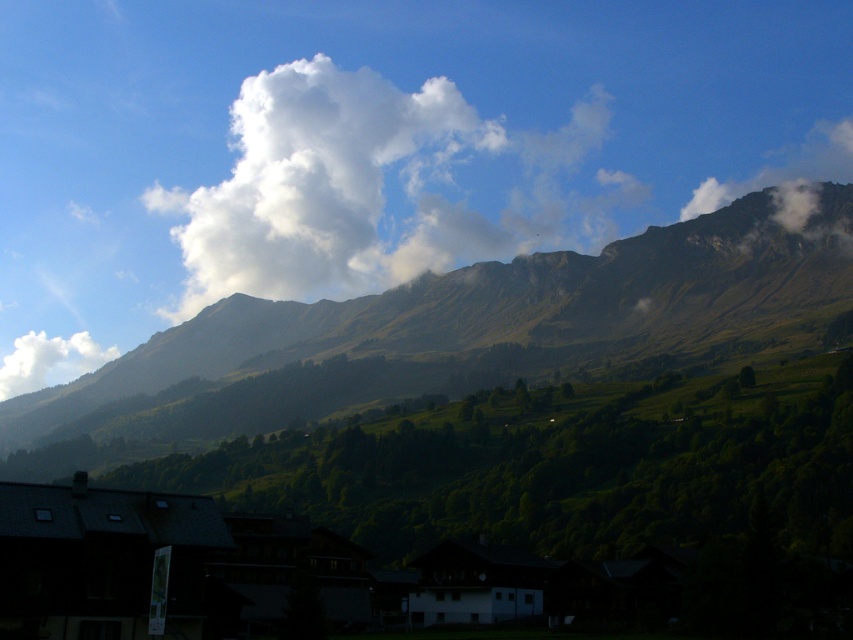
Question: Is the position of white fluffy cloud at upper right more distant than that of white fluffy cloud at upper left?

Choices:
 (A) yes
 (B) no

Answer: (B)

Question: Estimate the real-world distances between objects in this image. Which object is closer to the white fluffy cloud at upper right?

Choices:
 (A) white fluffy cloud at upper center
 (B) green grassy mountain at upper center
 (C) white fluffy cloud at upper left

Answer: (A)

Question: Is white fluffy cloud at upper right in front of white fluffy cloud at upper left?

Choices:
 (A) no
 (B) yes

Answer: (B)

Question: Is white fluffy cloud at upper center behind white fluffy cloud at upper left?

Choices:
 (A) no
 (B) yes

Answer: (A)

Question: Which object appears farthest from the camera in this image?

Choices:
 (A) white fluffy cloud at upper center
 (B) white fluffy cloud at upper left
 (C) green grassy mountain at upper center

Answer: (B)

Question: Which object is positioned closest to the white fluffy cloud at upper right?

Choices:
 (A) white fluffy cloud at upper center
 (B) green grassy mountain at upper center

Answer: (A)